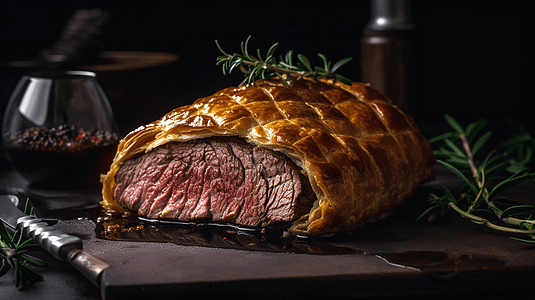
Find the location of a particular element. cutting board is located at coordinates (258, 265).